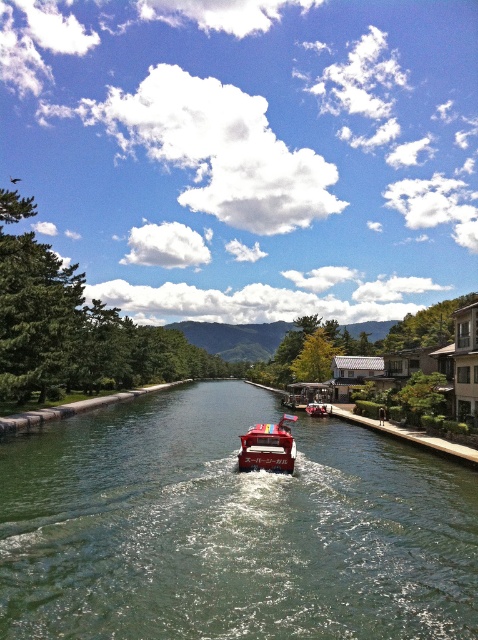
Does green glossy water at center have a greater height compared to metallic red boat at center?

In fact, green glossy water at center may be shorter than metallic red boat at center.

Measure the distance between point (217, 557) and camera.

Point (217, 557) and camera are 17.81 meters apart from each other.

In order to click on green glossy water at center in this screenshot , I will do `click(229, 529)`.

Does green glossy water at center have a lesser height compared to red glossy boat at center?

No, green glossy water at center is not shorter than red glossy boat at center.

Does green glossy water at center have a greater width compared to red glossy boat at center?

Yes, green glossy water at center is wider than red glossy boat at center.

Which is in front, point (216, 452) or point (325, 412)?

Positioned in front is point (216, 452).

The height and width of the screenshot is (640, 478). What are the coordinates of `green glossy water at center` in the screenshot? It's located at (229, 529).

Does metallic red boat at center have a larger size compared to red glossy boat at center?

Indeed, metallic red boat at center has a larger size compared to red glossy boat at center.

Can you confirm if metallic red boat at center is smaller than red glossy boat at center?

Actually, metallic red boat at center might be larger than red glossy boat at center.

This screenshot has height=640, width=478. What do you see at coordinates (268, 448) in the screenshot?
I see `metallic red boat at center` at bounding box center [268, 448].

Identify the location of metallic red boat at center. The height and width of the screenshot is (640, 478). click(x=268, y=448).